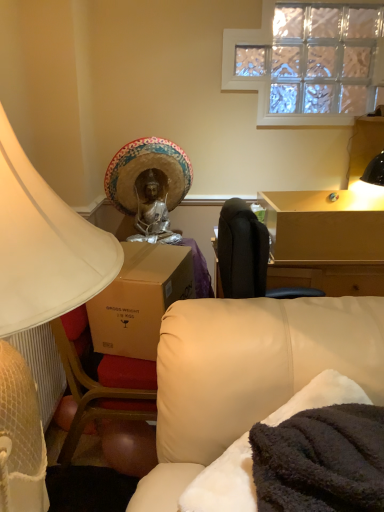
Question: Does straw hat at upper center appear on the right side of white matte lampshade at left?

Choices:
 (A) no
 (B) yes

Answer: (B)

Question: Can you see straw hat at upper center touching white matte lampshade at left?

Choices:
 (A) yes
 (B) no

Answer: (B)

Question: Is straw hat at upper center positioned behind white matte lampshade at left?

Choices:
 (A) yes
 (B) no

Answer: (A)

Question: From the image's perspective, is straw hat at upper center above white matte lampshade at left?

Choices:
 (A) no
 (B) yes

Answer: (B)

Question: Considering the relative sizes of straw hat at upper center and white matte lampshade at left in the image provided, is straw hat at upper center wider than white matte lampshade at left?

Choices:
 (A) yes
 (B) no

Answer: (B)

Question: Is clear glass window at upper center wider or thinner than light brown wooden table at upper right?

Choices:
 (A) thin
 (B) wide

Answer: (A)

Question: Based on their sizes in the image, would you say clear glass window at upper center is bigger or smaller than light brown wooden table at upper right?

Choices:
 (A) small
 (B) big

Answer: (A)

Question: Considering the positions of clear glass window at upper center and light brown wooden table at upper right in the image, is clear glass window at upper center taller or shorter than light brown wooden table at upper right?

Choices:
 (A) tall
 (B) short

Answer: (A)

Question: From the image's perspective, is clear glass window at upper center positioned above or below light brown wooden table at upper right?

Choices:
 (A) above
 (B) below

Answer: (A)

Question: Is clear glass window at upper center inside the boundaries of straw hat at upper center, or outside?

Choices:
 (A) inside
 (B) outside

Answer: (B)

Question: Is point (322, 52) closer or farther from the camera than point (170, 203)?

Choices:
 (A) closer
 (B) farther

Answer: (B)

Question: Considering the relative positions of clear glass window at upper center and straw hat at upper center in the image provided, is clear glass window at upper center to the left or to the right of straw hat at upper center?

Choices:
 (A) left
 (B) right

Answer: (B)

Question: From their relative heights in the image, would you say clear glass window at upper center is taller or shorter than straw hat at upper center?

Choices:
 (A) tall
 (B) short

Answer: (A)

Question: Is leather couch at lower right taller or shorter than white matte lampshade at left?

Choices:
 (A) tall
 (B) short

Answer: (B)

Question: Looking at their shapes, would you say leather couch at lower right is wider or thinner than white matte lampshade at left?

Choices:
 (A) thin
 (B) wide

Answer: (A)